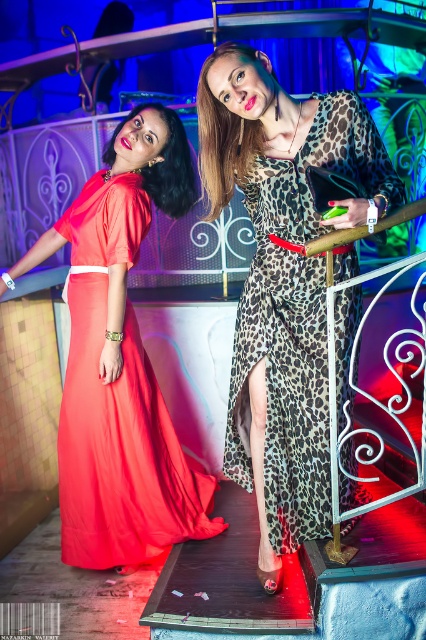
Question: Which point appears closest to the camera in this image?

Choices:
 (A) (146, 104)
 (B) (60, 451)
 (C) (252, 262)

Answer: (C)

Question: Is leopard print fabric dress at center further to camera compared to matte red dress at upper left?

Choices:
 (A) no
 (B) yes

Answer: (A)

Question: Which object is the farthest from the matte red dress at upper left?

Choices:
 (A) matte red dress at left
 (B) leopard print fabric dress at center

Answer: (B)

Question: Is leopard print fabric dress at center positioned before matte red dress at left?

Choices:
 (A) no
 (B) yes

Answer: (B)

Question: Where is leopard print fabric dress at center located in relation to matte red dress at left in the image?

Choices:
 (A) below
 (B) above

Answer: (B)

Question: Which point is closer to the camera?

Choices:
 (A) tap(278, 413)
 (B) tap(193, 170)

Answer: (A)